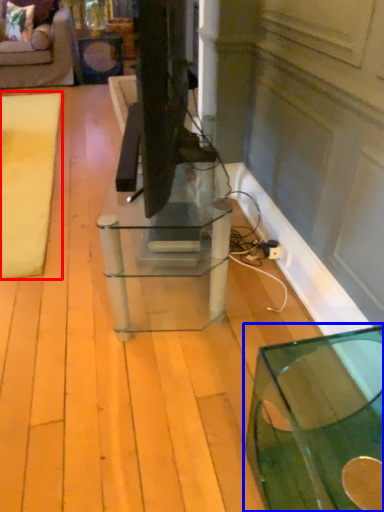
Question: Which of the following is the farthest to the observer, mat (highlighted by a red box) or table (highlighted by a blue box)?

Choices:
 (A) mat
 (B) table

Answer: (A)